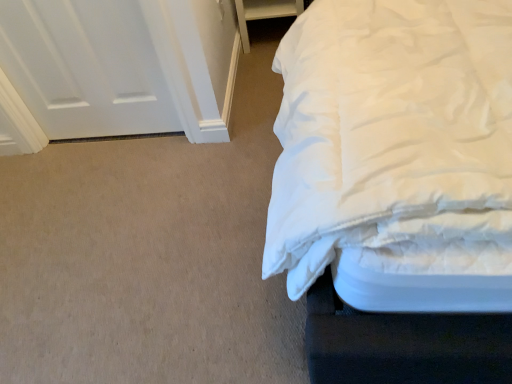
The width and height of the screenshot is (512, 384). I want to click on white matte door at upper left, so click(x=85, y=67).

Image resolution: width=512 pixels, height=384 pixels. What do you see at coordinates (85, 67) in the screenshot?
I see `white matte door at upper left` at bounding box center [85, 67].

Image resolution: width=512 pixels, height=384 pixels. In order to click on white fabric drawer at upper right in this screenshot , I will do `click(263, 13)`.

The width and height of the screenshot is (512, 384). Describe the element at coordinates (263, 13) in the screenshot. I see `white fabric drawer at upper right` at that location.

At what (x,y) coordinates should I click in order to perform the action: click on white matte door at upper left. Please return your answer as a coordinate pair (x, y). Looking at the image, I should click on (85, 67).

Which object is positioned more to the right, white fabric drawer at upper right or white matte door at upper left?

From the viewer's perspective, white fabric drawer at upper right appears more on the right side.

Based on the photo, is the depth of white fabric drawer at upper right less than that of white matte door at upper left?

No, white fabric drawer at upper right is behind white matte door at upper left.

Which point is more forward, (276, 0) or (150, 70)?

Point (150, 70)

From the image's perspective, which one is positioned higher, white fabric drawer at upper right or white matte door at upper left?

white fabric drawer at upper right appears higher in the image.

From a real-world perspective, is white fabric drawer at upper right beneath white matte door at upper left?

Yes, from a real-world perspective, white fabric drawer at upper right is below white matte door at upper left.

Considering the sizes of white fabric drawer at upper right and white matte door at upper left in the image, is white fabric drawer at upper right wider or thinner than white matte door at upper left?

white fabric drawer at upper right is wider than white matte door at upper left.

Who is taller, white fabric drawer at upper right or white matte door at upper left?

white matte door at upper left.

Who is smaller, white fabric drawer at upper right or white matte door at upper left?

white matte door at upper left.

Does white fabric drawer at upper right contain white matte door at upper left?

No, white matte door at upper left is not a part of white fabric drawer at upper right.

Is white fabric drawer at upper right positioned far away from white matte door at upper left?

They are positioned close to each other.

Is white fabric drawer at upper right oriented towards white matte door at upper left?

No.

How many degrees apart are the facing directions of white fabric drawer at upper right and white matte door at upper left?

The facing directions of white fabric drawer at upper right and white matte door at upper left are 1.79 degrees apart.

Identify the location of furniture behind the white matte door at upper left. The width and height of the screenshot is (512, 384). (263, 13).

Considering the relative positions of white matte door at upper left and white fabric drawer at upper right in the image provided, is white matte door at upper left to the left or to the right of white fabric drawer at upper right?

white matte door at upper left is to the left of white fabric drawer at upper right.

Considering the positions of objects white matte door at upper left and white fabric drawer at upper right in the image provided, who is behind, white matte door at upper left or white fabric drawer at upper right?

white fabric drawer at upper right is more distant.

Is point (157, 129) closer to camera compared to point (267, 17)?

Yes.

From the image's perspective, relative to white fabric drawer at upper right, is white matte door at upper left above or below?

white matte door at upper left is below white fabric drawer at upper right.

From a real-world perspective, is white matte door at upper left under white fabric drawer at upper right?

Incorrect, from a real-world perspective, white matte door at upper left is higher than white fabric drawer at upper right.

Which object is wider, white matte door at upper left or white fabric drawer at upper right?

white fabric drawer at upper right.

Considering the sizes of objects white matte door at upper left and white fabric drawer at upper right in the image provided, who is shorter, white matte door at upper left or white fabric drawer at upper right?

white fabric drawer at upper right is shorter.

In the scene shown: Who is smaller, white matte door at upper left or white fabric drawer at upper right?

white matte door at upper left is smaller.

Is white fabric drawer at upper right inside white matte door at upper left?

Actually, white fabric drawer at upper right is outside white matte door at upper left.

In the scene shown: Is white matte door at upper left touching white fabric drawer at upper right?

white matte door at upper left is not next to white fabric drawer at upper right, and they're not touching.

Is white matte door at upper left oriented towards white fabric drawer at upper right?

No, white matte door at upper left is not facing towards white fabric drawer at upper right.

How different are the orientations of white matte door at upper left and white fabric drawer at upper right in degrees?

1.79 degrees separate the facing orientations of white matte door at upper left and white fabric drawer at upper right.

How much distance is there between white matte door at upper left and white fabric drawer at upper right?

A distance of 31.09 inches exists between white matte door at upper left and white fabric drawer at upper right.

The width and height of the screenshot is (512, 384). Identify the location of door on the left of white fabric drawer at upper right. (85, 67).

Where is `furniture to the right of white matte door at upper left`? furniture to the right of white matte door at upper left is located at coordinates (263, 13).

Identify the location of door above the white fabric drawer at upper right (from a real-world perspective). (85, 67).